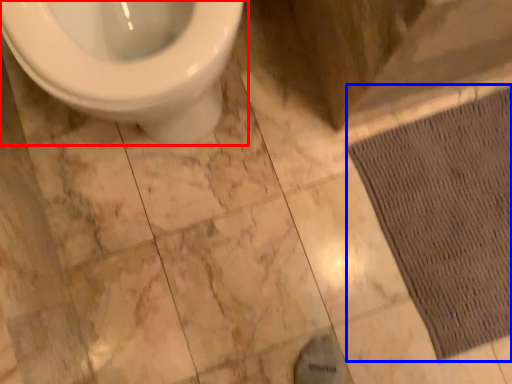
Question: Among these objects, which one is farthest to the camera, toilet (highlighted by a red box) or doormat (highlighted by a blue box)?

Choices:
 (A) toilet
 (B) doormat

Answer: (B)